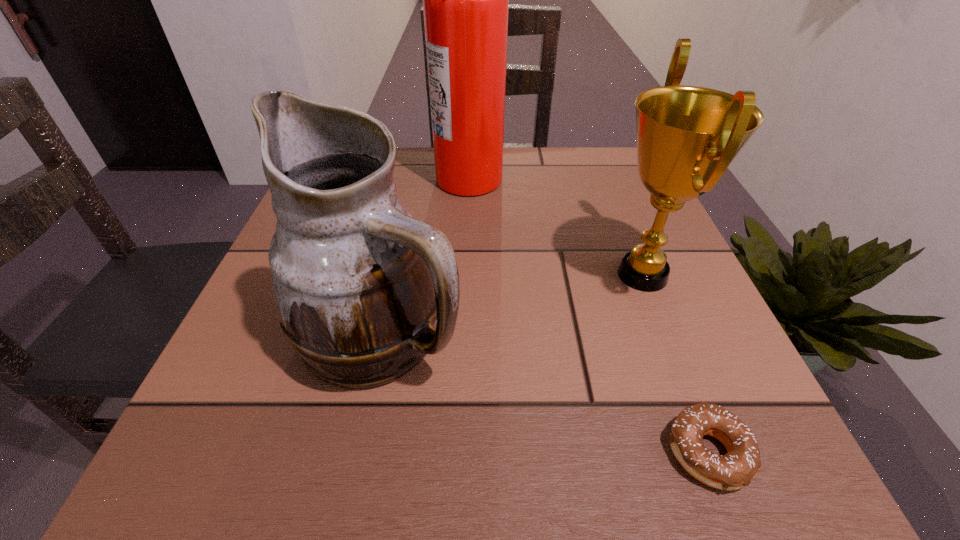
You are a GUI agent. You are given a task and a screenshot of the screen. Output one action in this format:
    pyautogui.click(x=<x>, y=<y>)
    Task: Click on the free space located 0.090m from the spout of the pitcher
    This screenshot has width=960, height=540.
    Given the screenshot: What is the action you would take?
    pyautogui.click(x=524, y=334)

Identify the location of vacant space located on the left of the doughnut. This screenshot has height=540, width=960. 545,453.

Identify the location of object positioned at the far edge. (465, 0).

Find the location of a particular element. object situated at the near edge is located at coordinates (735, 469).

Where is `object situated at the left edge`? object situated at the left edge is located at coordinates (358, 282).

Where is `award present at the right edge`? The image size is (960, 540). award present at the right edge is located at coordinates (687, 136).

Locate an element on the screen. doughnut that is positioned at the right edge is located at coordinates (735, 469).

The image size is (960, 540). Identify the location of object situated at the near right corner. (735, 469).

Locate an element on the screen. The image size is (960, 540). free region at the far edge of the desktop is located at coordinates (405, 166).

This screenshot has width=960, height=540. Identify the location of free space at the near edge of the desktop. (319, 462).